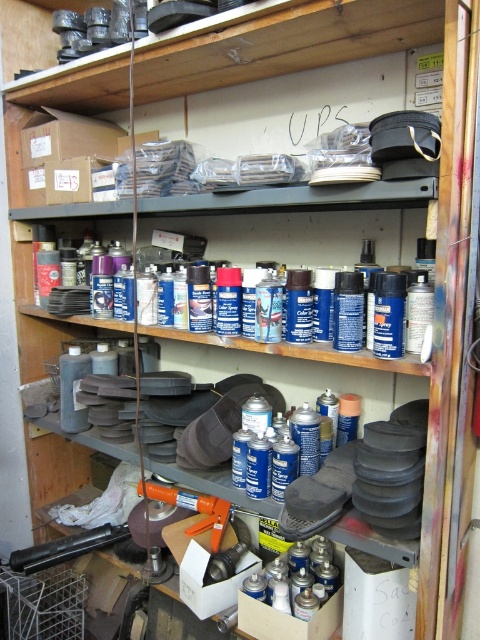
Question: Which point is farther from the camera taking this photo?

Choices:
 (A) (348, 248)
 (B) (212, 512)

Answer: (B)

Question: Which point appears farthest from the camera in this image?

Choices:
 (A) (205, 524)
 (B) (302, 352)

Answer: (A)

Question: Does blue matte spray cans at center appear under orange plastic caulking gun at center?

Choices:
 (A) no
 (B) yes

Answer: (A)

Question: Is blue matte spray cans at center below orange plastic caulking gun at center?

Choices:
 (A) yes
 (B) no

Answer: (B)

Question: Is blue matte spray cans at center smaller than orange plastic caulking gun at center?

Choices:
 (A) yes
 (B) no

Answer: (B)